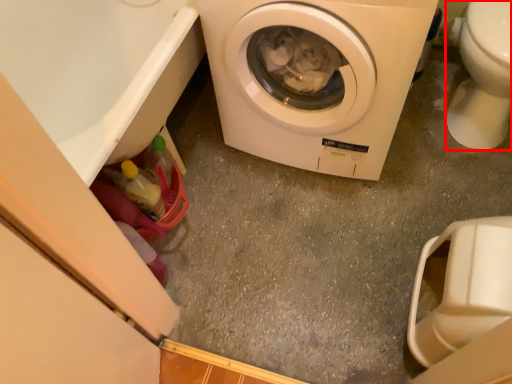
Question: From the image's perspective, considering the relative positions of toilet bowl (annotated by the red box) and washing machine in the image provided, where is toilet bowl (annotated by the red box) located with respect to the staircase?

Choices:
 (A) above
 (B) below

Answer: (A)